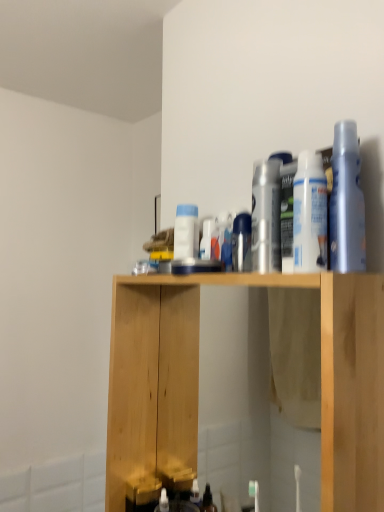
Question: Can you confirm if satin silver spray can at center is wider than white glossy spray can at center, the 4th cleaning product when ordered from front to back?

Choices:
 (A) no
 (B) yes

Answer: (A)

Question: Does satin silver spray can at center have a greater height compared to white glossy spray can at center, the 4th cleaning product when ordered from front to back?

Choices:
 (A) yes
 (B) no

Answer: (B)

Question: Is satin silver spray can at center to the right of white glossy spray can at center, which is counted as the first cleaning product, starting from the left, from the viewer's perspective?

Choices:
 (A) no
 (B) yes

Answer: (B)

Question: Can you confirm if satin silver spray can at center is positioned to the left of white glossy spray can at center, which is counted as the first cleaning product, starting from the left?

Choices:
 (A) yes
 (B) no

Answer: (B)

Question: Does satin silver spray can at center have a smaller size compared to white glossy spray can at center, acting as the first cleaning product starting from the back?

Choices:
 (A) no
 (B) yes

Answer: (B)

Question: In the image, is satin silver spray can at center positioned in front of or behind natural wood cabinet at center?

Choices:
 (A) behind
 (B) front

Answer: (A)

Question: Is satin silver spray can at center wider or thinner than natural wood cabinet at center?

Choices:
 (A) wide
 (B) thin

Answer: (B)

Question: Considering the relative positions of satin silver spray can at center and natural wood cabinet at center in the image provided, is satin silver spray can at center to the left or to the right of natural wood cabinet at center?

Choices:
 (A) right
 (B) left

Answer: (A)

Question: Would you say satin silver spray can at center is inside or outside natural wood cabinet at center?

Choices:
 (A) outside
 (B) inside

Answer: (A)

Question: Is satin silver spray can at center wider or thinner than silver metallic can at center, which is the 2th cleaning product from left to right?

Choices:
 (A) wide
 (B) thin

Answer: (B)

Question: From a real-world perspective, is satin silver spray can at center positioned above or below silver metallic can at center, which is the 2th cleaning product from left to right?

Choices:
 (A) above
 (B) below

Answer: (B)

Question: Is satin silver spray can at center situated inside silver metallic can at center, which is the 2th cleaning product from left to right, or outside?

Choices:
 (A) outside
 (B) inside

Answer: (A)

Question: From the image's perspective, is satin silver spray can at center above or below silver metallic can at center, arranged as the 2th cleaning product when viewed from the back?

Choices:
 (A) below
 (B) above

Answer: (A)

Question: Looking at their shapes, would you say translucent plastic spray bottle at upper right, marked as the first cleaning product in a front-to-back arrangement, is wider or thinner than white matte spray can at upper right, which ranks as the 2th cleaning product in right-to-left order?

Choices:
 (A) thin
 (B) wide

Answer: (A)

Question: Considering the positions of translucent plastic spray bottle at upper right, marked as the first cleaning product in a front-to-back arrangement, and white matte spray can at upper right, which ranks as the third cleaning product in left-to-right order, in the image, is translucent plastic spray bottle at upper right, marked as the first cleaning product in a front-to-back arrangement, taller or shorter than white matte spray can at upper right, which ranks as the third cleaning product in left-to-right order,?

Choices:
 (A) tall
 (B) short

Answer: (A)